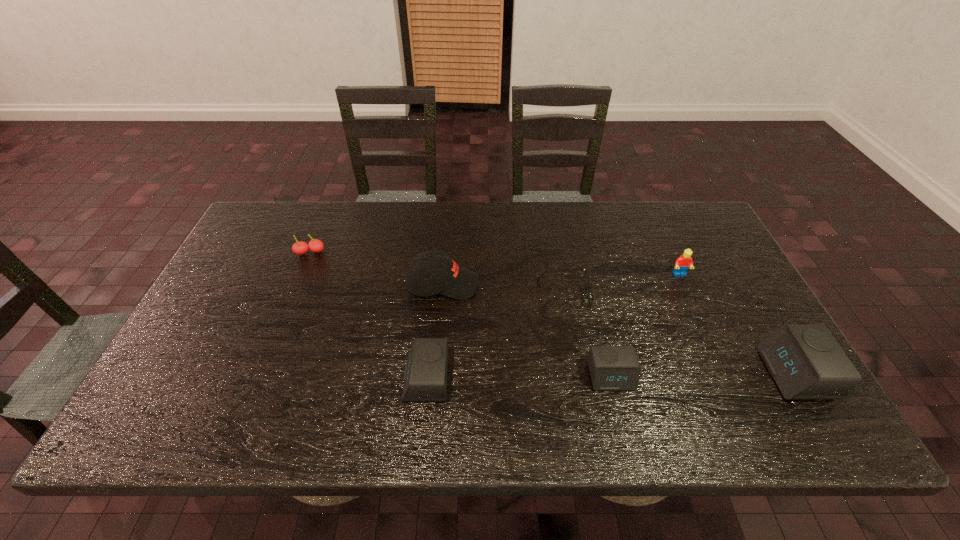
Where is `the second shortest alarm clock`? The image size is (960, 540). the second shortest alarm clock is located at coordinates (425, 377).

Locate an element on the screen. the second alarm clock from right to left is located at coordinates (612, 368).

Where is `the tallest alarm clock`? The image size is (960, 540). the tallest alarm clock is located at coordinates (805, 360).

Locate an element on the screen. The height and width of the screenshot is (540, 960). the rightmost object is located at coordinates (805, 360).

Where is `cherry`? The width and height of the screenshot is (960, 540). cherry is located at coordinates (300, 248).

Locate an element on the screen. the farthest object is located at coordinates (300, 248).

The width and height of the screenshot is (960, 540). What are the coordinates of `the shortest object` in the screenshot? It's located at tap(588, 287).

At what (x,y) coordinates should I click in order to perform the action: click on baseball cap. Please return your answer as a coordinate pair (x, y). Looking at the image, I should click on (424, 276).

This screenshot has width=960, height=540. In order to click on Lego in this screenshot , I will do `click(682, 264)`.

Where is `free space located 0.350m on the front-facing side of the second shortest alarm clock`? Image resolution: width=960 pixels, height=540 pixels. free space located 0.350m on the front-facing side of the second shortest alarm clock is located at coordinates (253, 379).